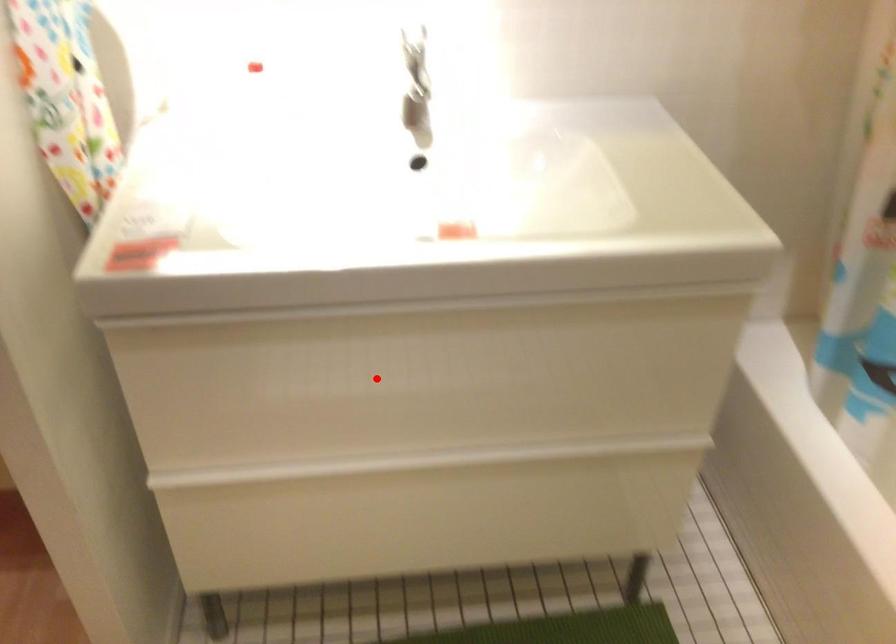
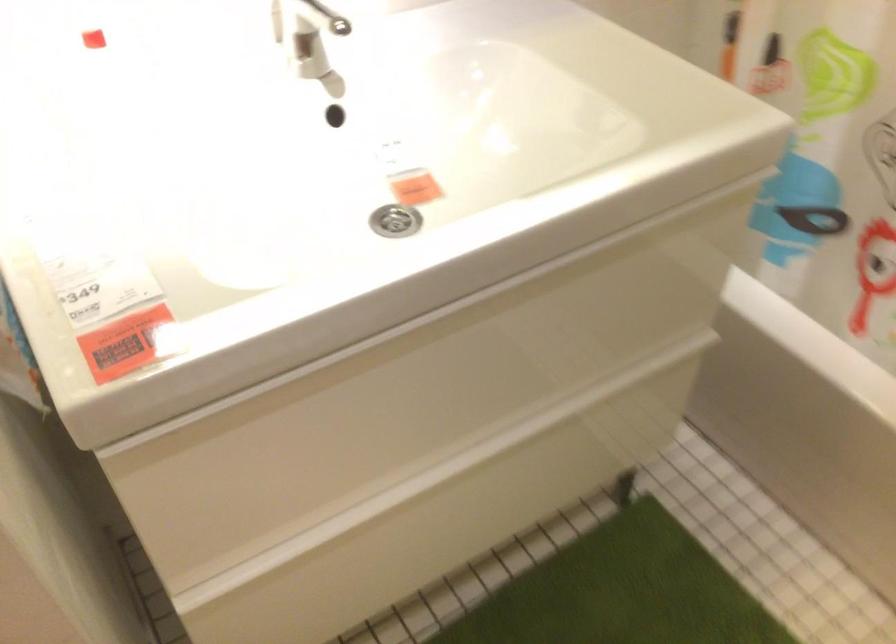
Question: A red point is marked in image1. In image2, is the corresponding 3D point closer to the camera or farther? Reply with the corresponding letter.

Choices:
 (A) The corresponding 3D point is closer.
 (B) The corresponding 3D point is farther.

Answer: (A)